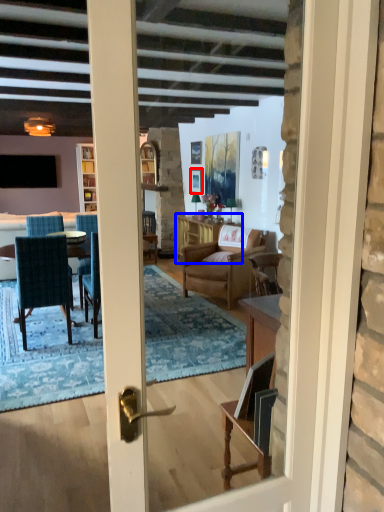
Question: Which point is closer to the camera, picture frame (highlighted by a red box) or table (highlighted by a blue box)?

Choices:
 (A) picture frame
 (B) table

Answer: (B)